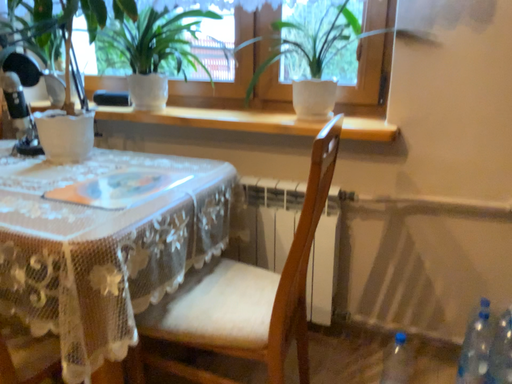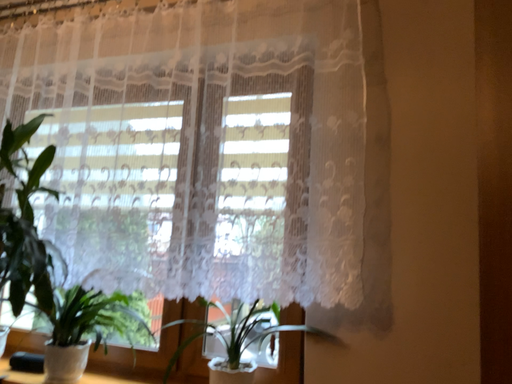
Question: Which way did the camera rotate in the video?

Choices:
 (A) rotated upward
 (B) rotated downward

Answer: (A)